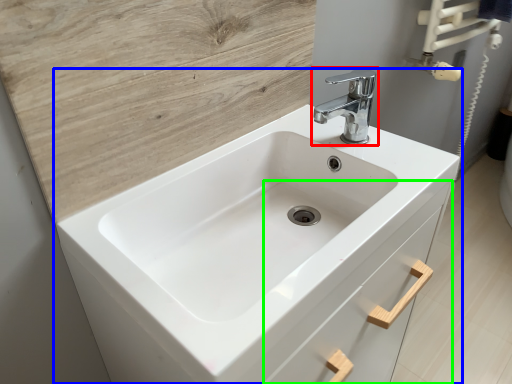
Question: Which is farther away from tap (highlighted by a red box)? sink (highlighted by a blue box) or drawer (highlighted by a green box)?

Choices:
 (A) sink
 (B) drawer

Answer: (B)